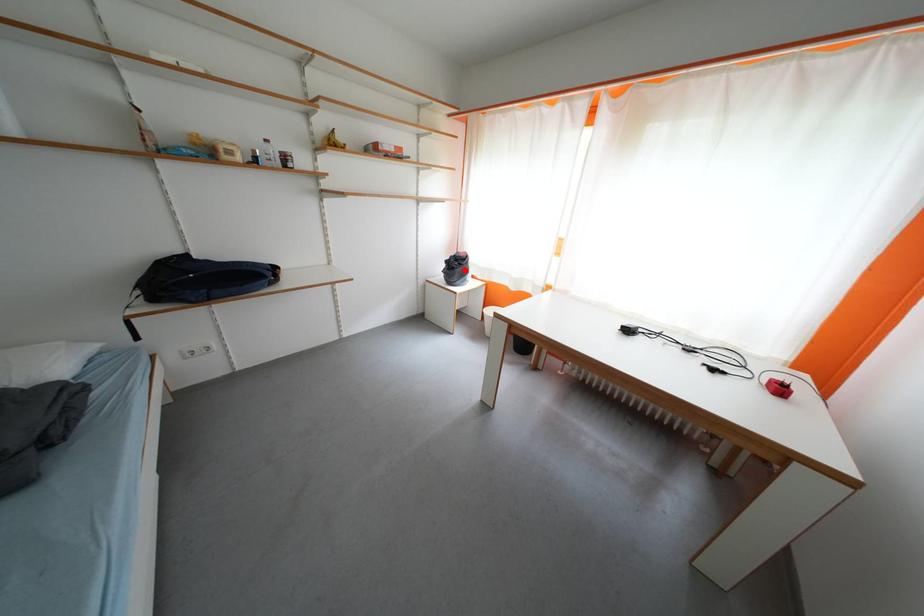
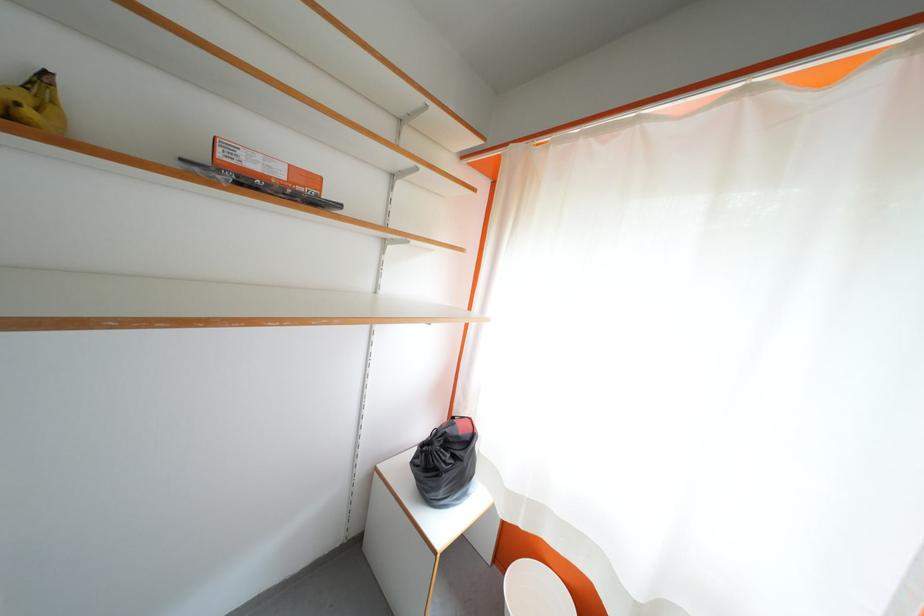
The point at the highlighted location is marked in the first image. Where is the corresponding point in the second image?

(455, 460)